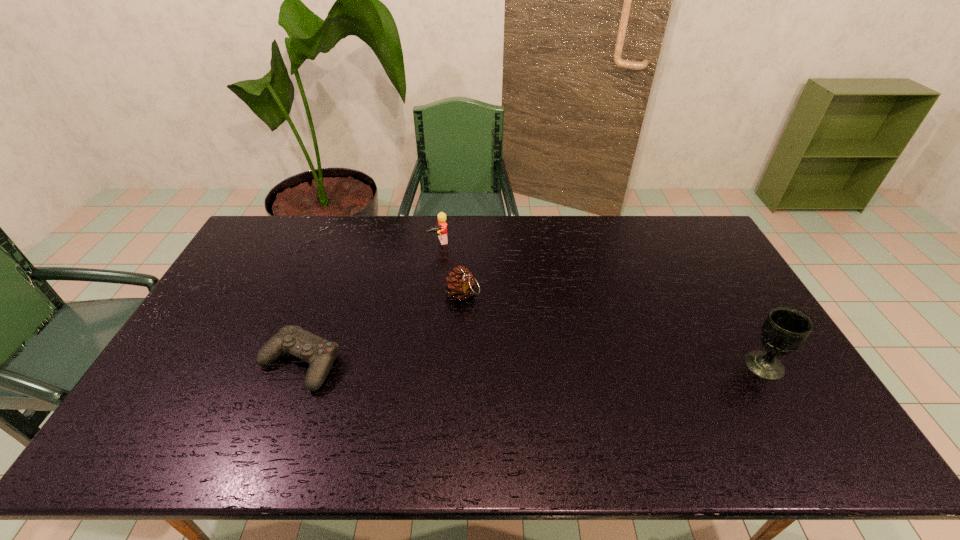
Find the location of a particular element. Image resolution: width=960 pixels, height=540 pixels. the shortest object is located at coordinates (320, 353).

Locate an element on the screen. The width and height of the screenshot is (960, 540). control is located at coordinates (320, 353).

In order to click on chalice in this screenshot , I will do `click(785, 329)`.

Where is `the tallest object`? The image size is (960, 540). the tallest object is located at coordinates (785, 329).

I want to click on the third object from right to left, so click(442, 225).

Find the location of a particular element. The height and width of the screenshot is (540, 960). Lego is located at coordinates click(442, 225).

Locate an element on the screen. Image resolution: width=960 pixels, height=540 pixels. the second farthest object is located at coordinates [x=460, y=284].

This screenshot has height=540, width=960. I want to click on the second object from right to left, so click(x=460, y=284).

Locate an element on the screen. The image size is (960, 540). free space located on the right of the leftmost object is located at coordinates (x=479, y=363).

This screenshot has width=960, height=540. Identify the location of blank area located 0.330m on the back of the chalice. [709, 273].